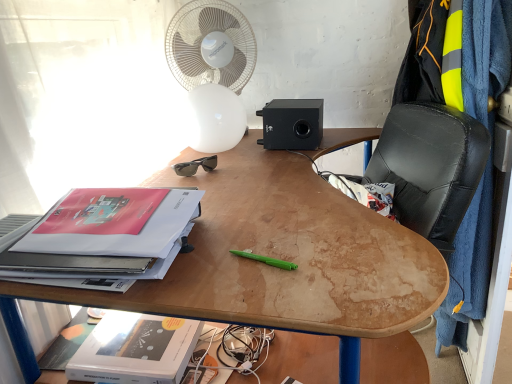
At what (x,y) coordinates should I click in order to perform the action: click on empty space that is to the right of green plastic pen at center. Please return your answer as a coordinate pair (x, y). The height and width of the screenshot is (384, 512). Looking at the image, I should click on (353, 251).